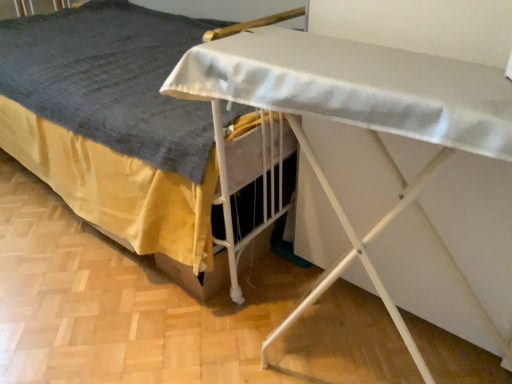
Find the location of `vacant area on top of white matte ironing board at lower center (from a real-world perspective)`. vacant area on top of white matte ironing board at lower center (from a real-world perspective) is located at coordinates (174, 294).